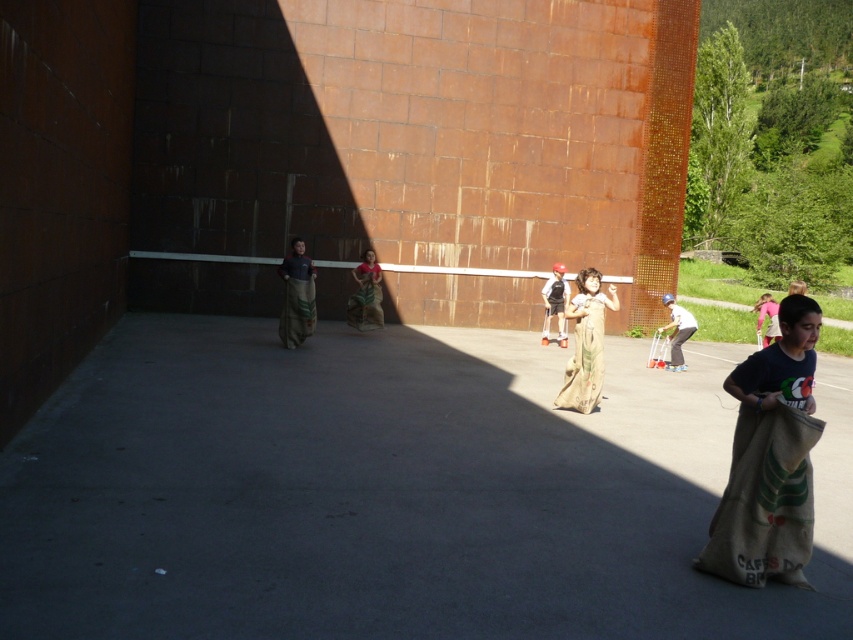
You are a photographer at the sack race event and want to capture both the brown burlap sack at center and the white cotton sack at center in a single shot. Based on their positions, which sack should you focus on first to ensure both are in frame?

The brown burlap sack at center is to the left of white cotton sack at center, so you should focus on the brown burlap sack at center first to ensure both are in frame.

You are a photographer trying to capture both the brown burlap sack at center and the white cotton sack at center in a single shot. Since they are positioned differently, which sack should you focus on first to ensure both are in frame?

The brown burlap sack at center is located above the white cotton sack at center, so you should focus on the white cotton sack at center first to ensure both are in frame.